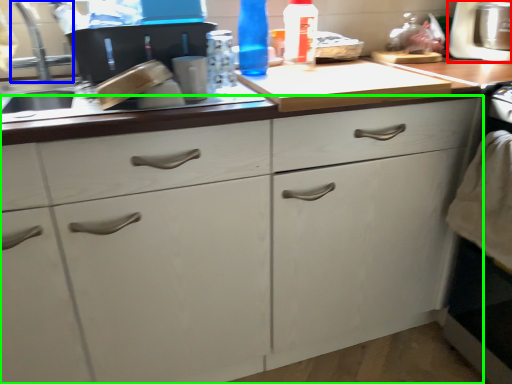
Question: Estimate the real-world distances between objects in this image. Which object is farther from appliance (highlighted by a red box), faucet (highlighted by a blue box) or cabinetry (highlighted by a green box)?

Choices:
 (A) faucet
 (B) cabinetry

Answer: (A)